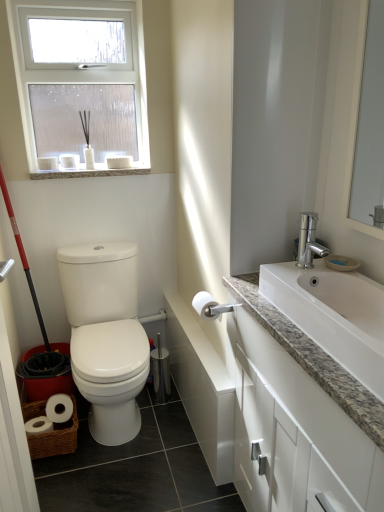
Question: Is white glossy toilet paper at center outside red plastic screen door at left?

Choices:
 (A) no
 (B) yes

Answer: (B)

Question: From a real-world perspective, is white glossy toilet paper at center over red plastic screen door at left?

Choices:
 (A) no
 (B) yes

Answer: (A)

Question: Can you confirm if white glossy toilet paper at center is positioned to the right of red plastic screen door at left?

Choices:
 (A) yes
 (B) no

Answer: (A)

Question: Does white glossy toilet paper at center have a greater width compared to red plastic screen door at left?

Choices:
 (A) yes
 (B) no

Answer: (B)

Question: Can you confirm if white glossy toilet paper at center is positioned to the left of red plastic screen door at left?

Choices:
 (A) no
 (B) yes

Answer: (A)

Question: From their relative heights in the image, would you say red plastic screen door at left is taller or shorter than white granite countertop at right?

Choices:
 (A) tall
 (B) short

Answer: (A)

Question: In the image, is red plastic screen door at left on the left side or the right side of white granite countertop at right?

Choices:
 (A) left
 (B) right

Answer: (A)

Question: In the image, is red plastic screen door at left positioned in front of or behind white granite countertop at right?

Choices:
 (A) behind
 (B) front

Answer: (B)

Question: In terms of size, does red plastic screen door at left appear bigger or smaller than white granite countertop at right?

Choices:
 (A) small
 (B) big

Answer: (A)

Question: Considering the positions of point (102, 263) and point (64, 82), is point (102, 263) closer or farther from the camera than point (64, 82)?

Choices:
 (A) farther
 (B) closer

Answer: (B)

Question: Is white glossy toilet at left wider or thinner than white frosted glass window at upper left?

Choices:
 (A) thin
 (B) wide

Answer: (B)

Question: From a real-world perspective, is white glossy toilet at left positioned above or below white frosted glass window at upper left?

Choices:
 (A) above
 (B) below

Answer: (B)

Question: Based on their sizes in the image, would you say white glossy toilet at left is bigger or smaller than white frosted glass window at upper left?

Choices:
 (A) small
 (B) big

Answer: (B)

Question: Is point (218, 476) positioned closer to the camera than point (99, 359)?

Choices:
 (A) farther
 (B) closer

Answer: (B)

Question: From the image's perspective, is white glossy toilet paper at center above or below white glossy toilet at left?

Choices:
 (A) below
 (B) above

Answer: (B)